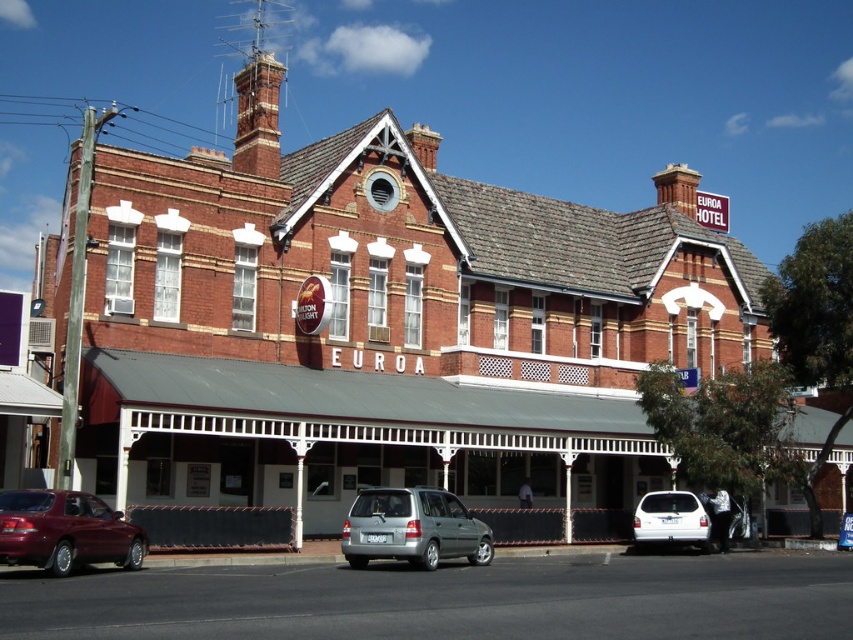
You are standing at the entrance of the EUROA HOTEL and want to take a photo of the point at coordinates point (x=99, y=513). If your camera has a maximum focus range of 35 meters, will you be able to capture it clearly?

The point (x=99, y=513) is 37.08 meters from the camera, which exceeds the camera maximum focus range of 35 meters. Therefore, the camera cannot capture it clearly.

You are a delivery driver who needs to park your silver metallic minivan at center in a parking spot located at coordinates 0.827, 0.484. Is the parking spot directly under the building? Please answer based on the scene description.

The silver metallic minivan at center is already positioned at the coordinates (412, 529), which matches the location of the parking spot. Since the minivan is at that point, it is parked there, but the scene description does not specify whether this spot is directly under the building or not. Therefore, we cannot confirm if it is directly under the building based on the provided information.

You are a delivery person trying to park your 1.8 meters tall package in front of the Euroa Hotel. The shiny maroon sedan at lower left and the white matte van at lower right are already parked there. Which vehicle should you avoid parking next to if you need to keep your package upright without tilting?

The shiny maroon sedan at lower left has a greater height compared to the white matte van at lower right. Therefore, you should avoid parking next to the shiny maroon sedan at lower left because its height might obstruct the package from staying upright.